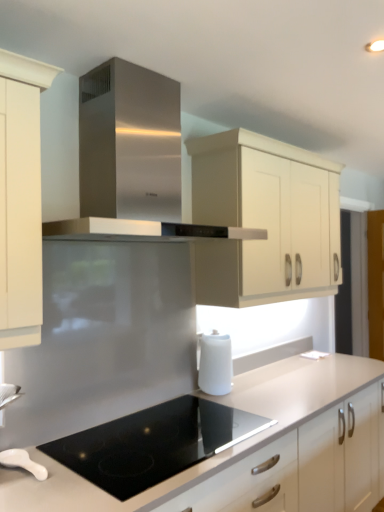
Question: Considering the relative positions of black glass cooktop at center and white matte kettle at lower center, positioned as the 1th kitchen appliance in right-to-left order, in the image provided, is black glass cooktop at center to the right of white matte kettle at lower center, positioned as the 1th kitchen appliance in right-to-left order, from the viewer's perspective?

Choices:
 (A) yes
 (B) no

Answer: (B)

Question: Is black glass cooktop at center to the left of white matte kettle at lower center, positioned as the 1th kitchen appliance in right-to-left order, from the viewer's perspective?

Choices:
 (A) yes
 (B) no

Answer: (A)

Question: Can you confirm if black glass cooktop at center is taller than white matte kettle at lower center, the 2th kitchen appliance in the bottom-to-top sequence?

Choices:
 (A) no
 (B) yes

Answer: (A)

Question: Does black glass cooktop at center come in front of white matte kettle at lower center, the second kitchen appliance positioned from the front?

Choices:
 (A) no
 (B) yes

Answer: (B)

Question: Is white matte kettle at lower center, which is the second kitchen appliance from left to right, completely or partially inside black glass cooktop at center?

Choices:
 (A) yes
 (B) no

Answer: (B)

Question: From a real-world perspective, is black glass cooktop at center physically below white matte kettle at lower center, positioned as the 1th kitchen appliance in right-to-left order?

Choices:
 (A) no
 (B) yes

Answer: (B)

Question: Can you confirm if black glass cooktop at center is shorter than white glossy spoon at lower left, arranged as the first kitchen appliance when viewed from the left?

Choices:
 (A) yes
 (B) no

Answer: (B)

Question: Would you say black glass cooktop at center is a long distance from white glossy spoon at lower left, which is the first kitchen appliance from front to back?

Choices:
 (A) yes
 (B) no

Answer: (B)

Question: Considering the relative positions of black glass cooktop at center and white glossy spoon at lower left, the second kitchen appliance in the top-to-bottom sequence, in the image provided, is black glass cooktop at center to the right of white glossy spoon at lower left, the second kitchen appliance in the top-to-bottom sequence, from the viewer's perspective?

Choices:
 (A) no
 (B) yes

Answer: (B)

Question: Is white glossy spoon at lower left, the 2th kitchen appliance positioned from the right, located within black glass cooktop at center?

Choices:
 (A) yes
 (B) no

Answer: (B)

Question: From the image's perspective, is black glass cooktop at center under white glossy spoon at lower left, the second kitchen appliance in the top-to-bottom sequence?

Choices:
 (A) no
 (B) yes

Answer: (A)

Question: Does black glass cooktop at center have a smaller size compared to white glossy spoon at lower left, the 2th kitchen appliance positioned from the right?

Choices:
 (A) no
 (B) yes

Answer: (A)

Question: Is the depth of cream matte cabinet at upper center less than that of white matte countertop at center?

Choices:
 (A) no
 (B) yes

Answer: (A)